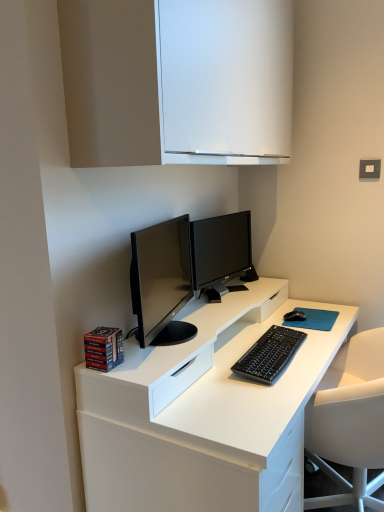
Question: From the image's perspective, is black matte keyboard at center on satin black monitor at center?

Choices:
 (A) no
 (B) yes

Answer: (A)

Question: Is there a large distance between black matte keyboard at center and satin black monitor at center?

Choices:
 (A) yes
 (B) no

Answer: (B)

Question: Does black matte keyboard at center have a lesser height compared to satin black monitor at center?

Choices:
 (A) yes
 (B) no

Answer: (A)

Question: Is black matte keyboard at center turned away from satin black monitor at center?

Choices:
 (A) yes
 (B) no

Answer: (B)

Question: Considering the relative sizes of black matte keyboard at center and satin black monitor at center in the image provided, is black matte keyboard at center wider than satin black monitor at center?

Choices:
 (A) yes
 (B) no

Answer: (A)

Question: Is black matte keyboard at center to the right of satin black monitor at center from the viewer's perspective?

Choices:
 (A) no
 (B) yes

Answer: (B)

Question: From the image's perspective, would you say white matte cabinet at upper center is shown under black matte mouse at right?

Choices:
 (A) no
 (B) yes

Answer: (A)

Question: Is white matte cabinet at upper center far from black matte mouse at right?

Choices:
 (A) no
 (B) yes

Answer: (B)

Question: Considering the relative sizes of white matte cabinet at upper center and black matte mouse at right in the image provided, is white matte cabinet at upper center wider than black matte mouse at right?

Choices:
 (A) no
 (B) yes

Answer: (B)

Question: Does white matte cabinet at upper center have a larger size compared to black matte mouse at right?

Choices:
 (A) yes
 (B) no

Answer: (A)

Question: From the image's perspective, does white matte cabinet at upper center appear higher than black matte mouse at right?

Choices:
 (A) yes
 (B) no

Answer: (A)

Question: Can you confirm if white matte cabinet at upper center is taller than black matte mouse at right?

Choices:
 (A) yes
 (B) no

Answer: (A)

Question: From the image's perspective, is black matte mouse at right beneath satin black monitor at center?

Choices:
 (A) no
 (B) yes

Answer: (B)